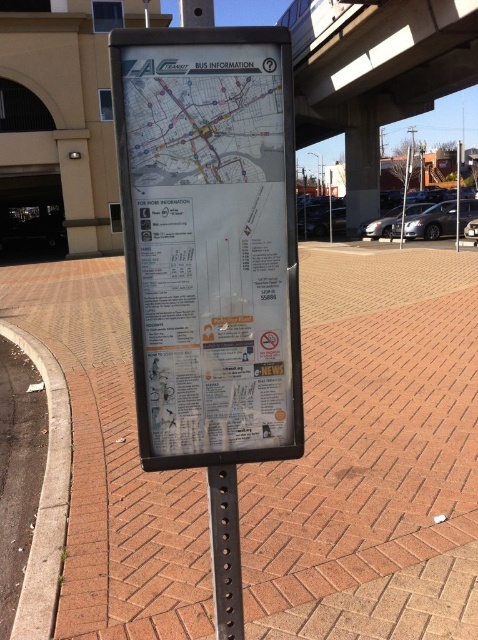
Question: Which point is closer to the camera?

Choices:
 (A) brick pavement at center
 (B) white plastic map at center

Answer: (B)

Question: Which object appears farthest from the camera in this image?

Choices:
 (A) black metal pole at center
 (B) white plastic map at center
 (C) brick pavement at center

Answer: (C)

Question: Among these points, which one is nearest to the camera?

Choices:
 (A) (90, 344)
 (B) (230, 508)

Answer: (B)

Question: Is white plastic map at center further to the viewer compared to black metal pole at center?

Choices:
 (A) no
 (B) yes

Answer: (A)

Question: Can you confirm if brick pavement at center is smaller than black metal pole at center?

Choices:
 (A) yes
 (B) no

Answer: (B)

Question: Does brick pavement at center appear under white plastic map at center?

Choices:
 (A) no
 (B) yes

Answer: (A)